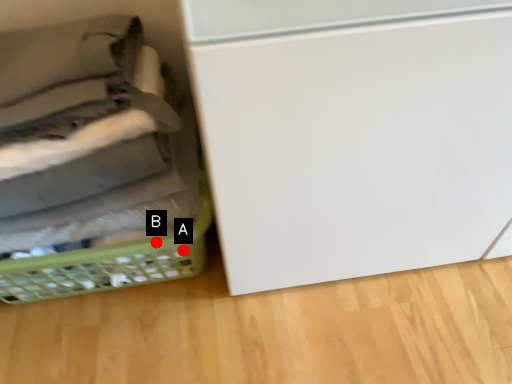
Question: Two points are circled on the image, labeled by A and B beside each circle. Which of the following is the closest to the observer?

Choices:
 (A) A is closer
 (B) B is closer

Answer: (B)